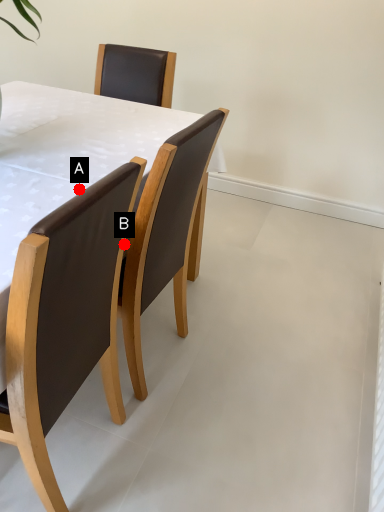
Question: Two points are circled on the image, labeled by A and B beside each circle. Which of the following is the closest to the observer?

Choices:
 (A) A is closer
 (B) B is closer

Answer: (A)